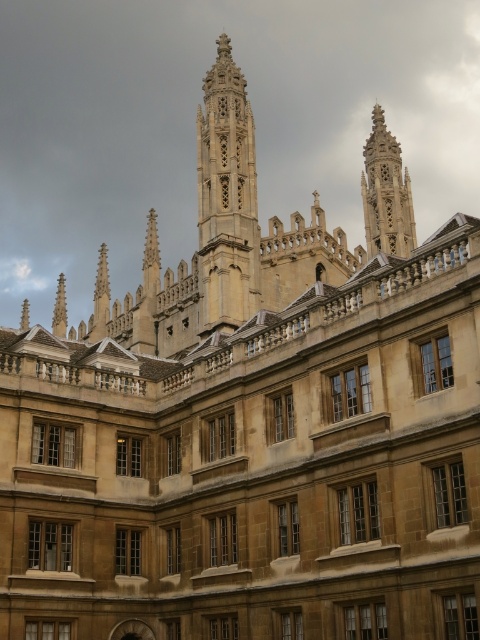
You are standing in front of the grand Gothic structure and notice two points marked on the building. The first point is at coordinates point (x=217, y=259) and the second at point (x=374, y=211). Which of these points is nearer to your current position?

Point (x=217, y=259) is closer to the camera than point (x=374, y=211), so the first point is nearer to your current position.